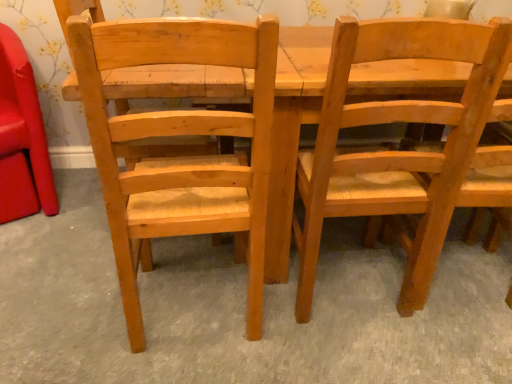
Locate an element on the screen. free space in front of light brown wood chair at center, the 3th chair in the left-to-right sequence is located at coordinates (360, 355).